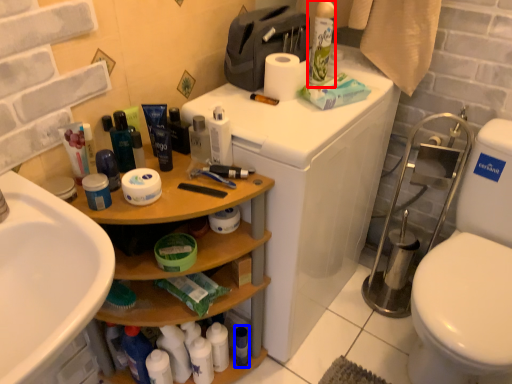
Question: Which of the following is the farthest to the observer, cleaning product (highlighted by a red box) or toiletry (highlighted by a blue box)?

Choices:
 (A) cleaning product
 (B) toiletry

Answer: (B)